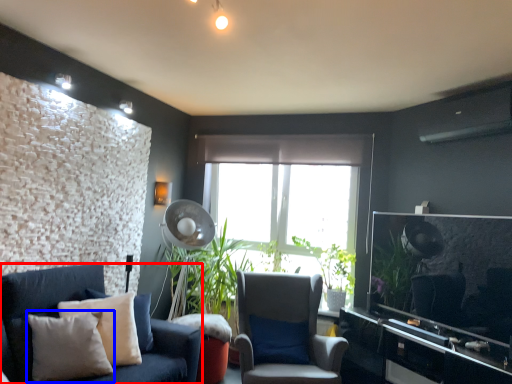
Question: Which point is closer to the camera, studio couch (highlighted by a red box) or pillow (highlighted by a blue box)?

Choices:
 (A) studio couch
 (B) pillow

Answer: (B)